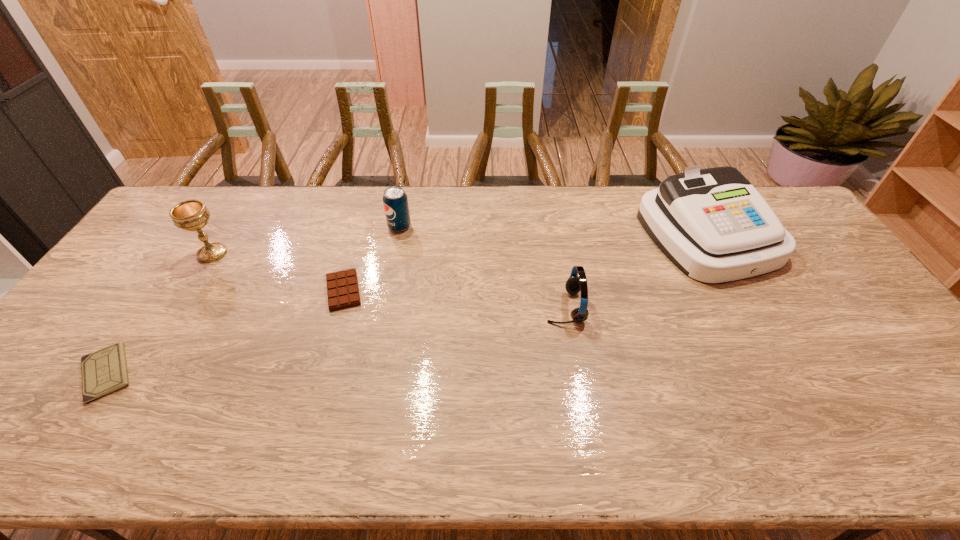
The image size is (960, 540). I want to click on object positioned at the far right corner, so click(x=712, y=224).

This screenshot has width=960, height=540. In the image, there is a desktop. What are the coordinates of `free space at the far edge` in the screenshot? It's located at (463, 192).

Locate an element on the screen. The height and width of the screenshot is (540, 960). free spot at the near edge of the desktop is located at coordinates (822, 429).

Locate an element on the screen. This screenshot has height=540, width=960. blank space at the left edge of the desktop is located at coordinates (150, 244).

The width and height of the screenshot is (960, 540). In the image, there is a desktop. What are the coordinates of `free space at the right edge` in the screenshot? It's located at [x=812, y=301].

I want to click on blank space at the near left corner, so click(56, 434).

This screenshot has width=960, height=540. What are the coordinates of `free space between the shortest object and the cash register` in the screenshot? It's located at (407, 304).

Identify the location of free point between the cash register and the second object from right to left. (636, 271).

You are a GUI agent. You are given a task and a screenshot of the screen. Output one action in this format:
    pyautogui.click(x=<x>, y=<y>)
    Task: Click on the free area in between the third object from right to left and the chalice
    
    Given the screenshot: What is the action you would take?
    pyautogui.click(x=306, y=240)

Locate an element on the screen. free space between the nearest object and the rightmost object is located at coordinates (407, 304).